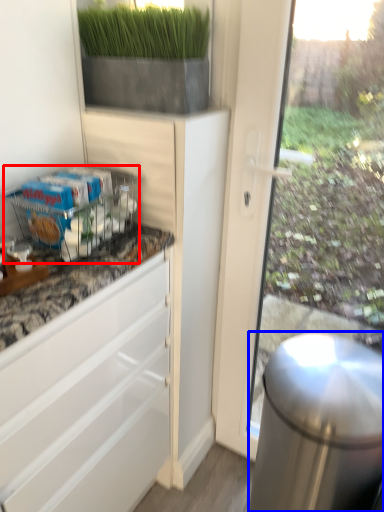
Question: Which object appears closest to the camera in this image, shelf (highlighted by a red box) or appliance (highlighted by a blue box)?

Choices:
 (A) shelf
 (B) appliance

Answer: (B)